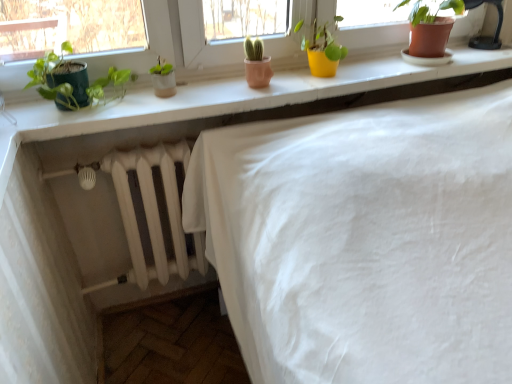
Locate an element on the screen. The image size is (512, 384). free region on the left part of yellow matte pot at upper center, which is counted as the 2th houseplant, starting from the left is located at coordinates (282, 81).